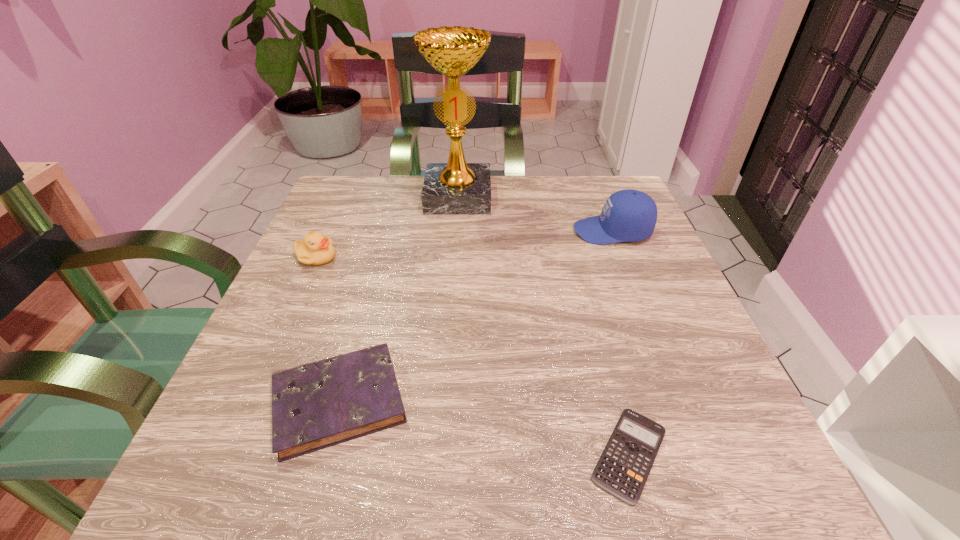
Where is `the tallest object`? The width and height of the screenshot is (960, 540). the tallest object is located at coordinates (455, 188).

I want to click on the farthest object, so click(x=455, y=188).

What are the coordinates of `the second tallest object` in the screenshot? It's located at (628, 215).

This screenshot has width=960, height=540. I want to click on the third tallest object, so click(x=315, y=249).

Locate an element on the screen. Image resolution: width=960 pixels, height=540 pixels. diary is located at coordinates (317, 405).

This screenshot has width=960, height=540. Identify the location of the shortest object. tap(624, 466).

Locate an element on the screen. This screenshot has width=960, height=540. vacant space located 0.180m on the front-facing side of the tallest object is located at coordinates 453,264.

You are a GUI agent. You are given a task and a screenshot of the screen. Output one action in this format:
    pyautogui.click(x=<x>, y=<y>)
    Task: Click on the free spot located on the front-facing side of the second tallest object
    
    Given the screenshot: What is the action you would take?
    pyautogui.click(x=438, y=231)

I want to click on vacant space located 0.180m on the front-facing side of the second tallest object, so click(x=492, y=231).

Locate an element on the screen. Image resolution: width=960 pixels, height=540 pixels. vacant space situated on the front-facing side of the second tallest object is located at coordinates (396, 231).